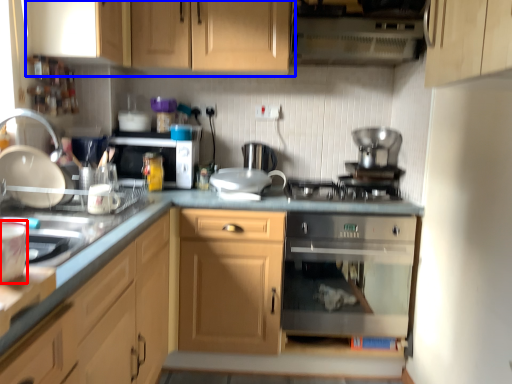
Question: Which of the following is the farthest to the observer, appliance (highlighted by a red box) or cabinetry (highlighted by a blue box)?

Choices:
 (A) appliance
 (B) cabinetry

Answer: (B)